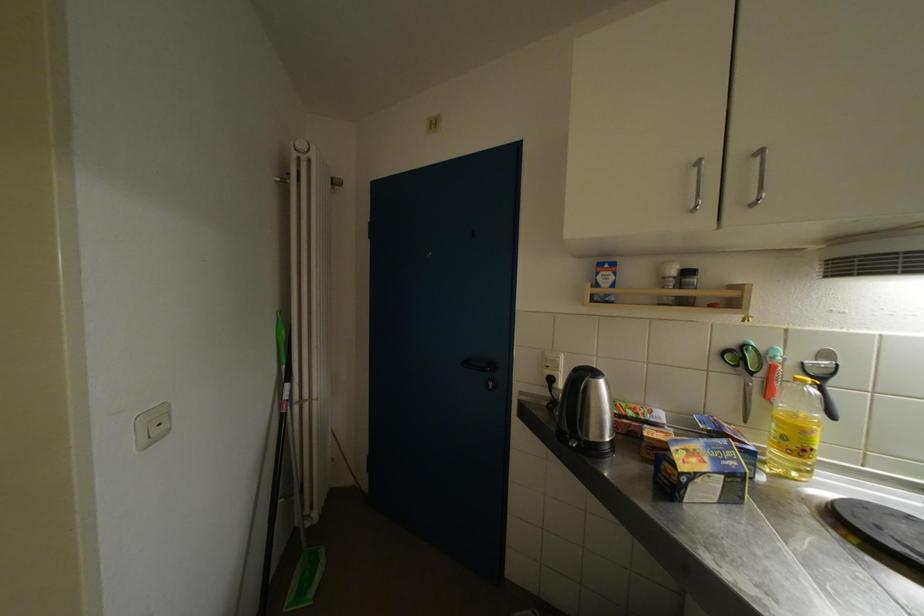
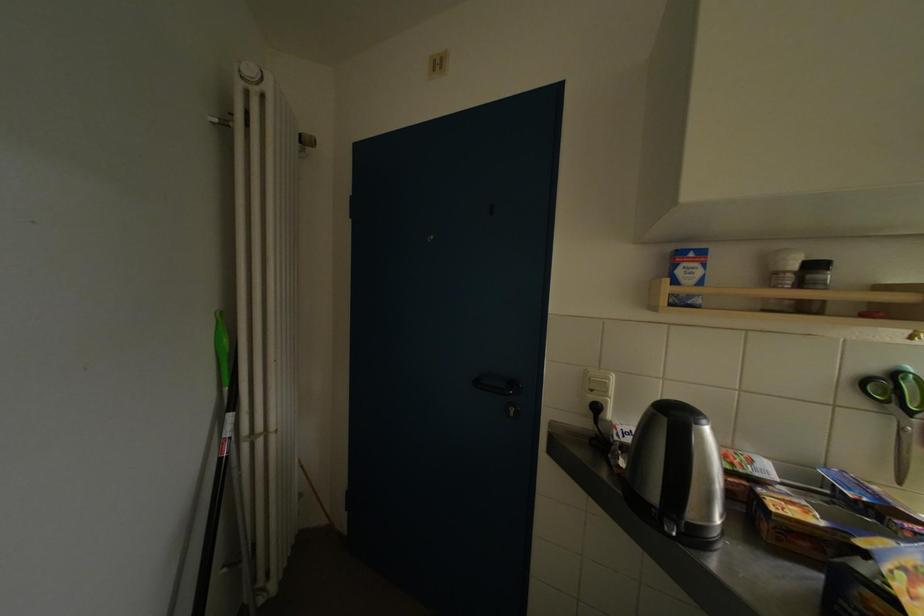
The point at [472,368] is marked in the first image. Where is the corresponding point in the second image?

(484, 387)